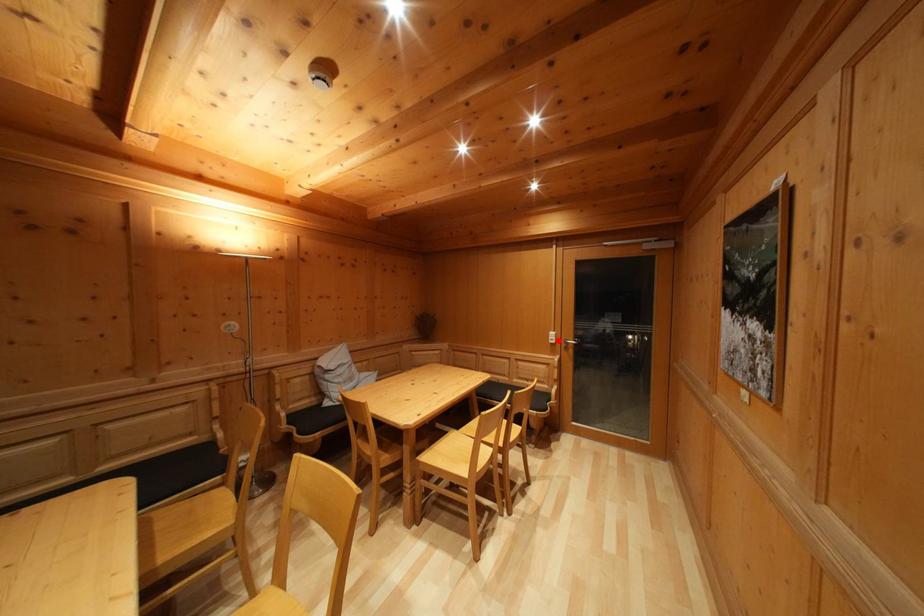
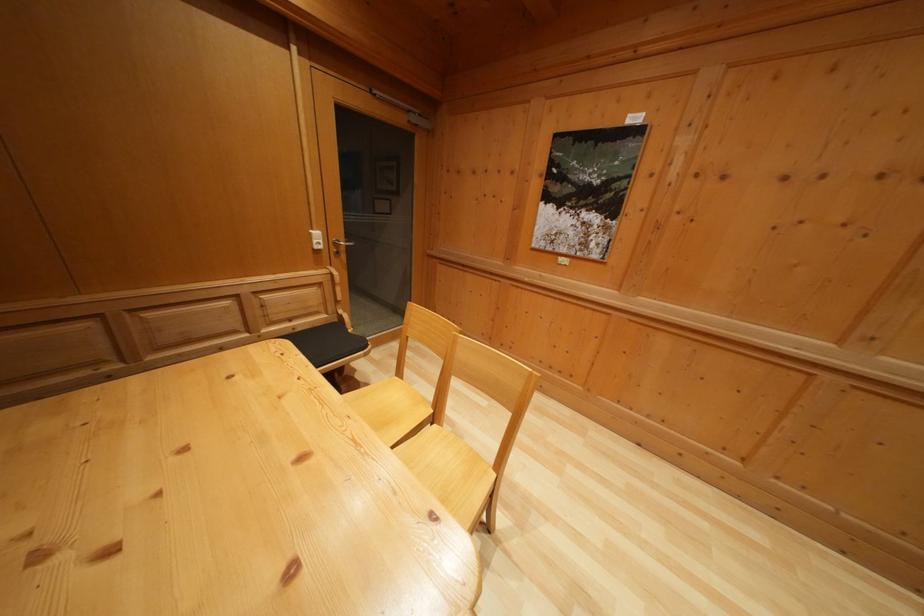
Where in the second image is the point corresponding to the highlighted location from the first image?

(322, 240)